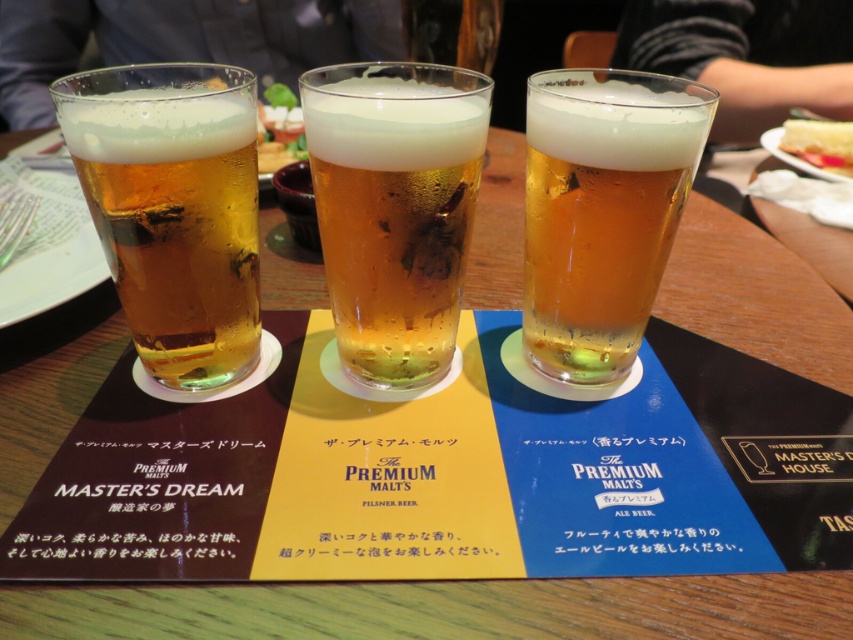
Question: Does translucent amber glass at left come behind green leafy vegetable at center?

Choices:
 (A) yes
 (B) no

Answer: (B)

Question: Which point is closer to the camera?

Choices:
 (A) translucent amber glass at left
 (B) green leafy vegetable at center

Answer: (A)

Question: Does translucent amber glass at center have a larger size compared to translucent amber glass at left?

Choices:
 (A) no
 (B) yes

Answer: (B)

Question: Is translucent amber glass at center behind green leafy vegetable at center?

Choices:
 (A) yes
 (B) no

Answer: (B)

Question: Which is farther from the translucent glass beer at center?

Choices:
 (A) translucent amber glass at left
 (B) green leafy vegetable at center
 (C) yellow cake with frosting at upper right

Answer: (C)

Question: Which of the following is the farthest from the observer?

Choices:
 (A) yellow cake with frosting at upper right
 (B) green leafy vegetable at center
 (C) translucent glass beer at center
 (D) translucent amber glass at left

Answer: (A)